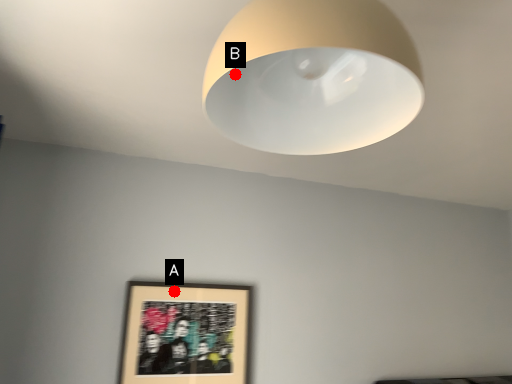
Question: Two points are circled on the image, labeled by A and B beside each circle. Which point is closer to the camera?

Choices:
 (A) A is closer
 (B) B is closer

Answer: (B)